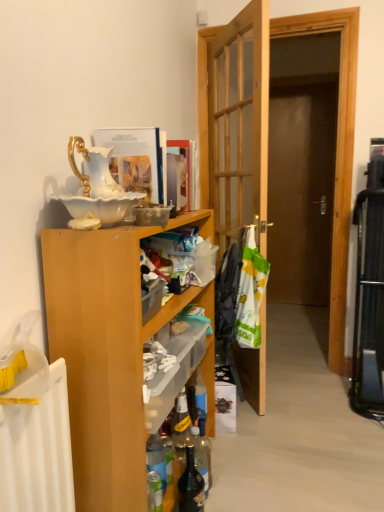
Question: From a real-world perspective, is translucent plastic shelf at center above or below wooden door at center?

Choices:
 (A) below
 (B) above

Answer: (A)

Question: In terms of width, does translucent plastic shelf at center look wider or thinner when compared to wooden door at center?

Choices:
 (A) wide
 (B) thin

Answer: (B)

Question: Estimate the real-world distances between objects in this image. Which object is farther from the translucent glass bottle at lower center, marked as the second bottle in a right-to-left arrangement?

Choices:
 (A) matte paper magazine at upper center, the second magazine in the front-to-back sequence
 (B) translucent plastic shelf at center
 (C) wooden door at center
 (D) white plastic laundry at center, the first laundry viewed from the back
 (E) dark glass bottle at lower center, which is the 1th bottle in right-to-left order

Answer: (C)

Question: Which of these objects is positioned farthest from the translucent plastic shelf at center?

Choices:
 (A) matte paper magazine at upper center, the 1th magazine from the right
 (B) translucent glass bottle at lower center, which appears as the first bottle when viewed from the left
 (C) dark glass bottle at lower center, positioned as the 2th bottle in left-to-right order
 (D) white plastic bag at center, the 1th laundry in the front-to-back sequence
 (E) white glossy book at upper center, which is the first magazine in left-to-right order

Answer: (A)